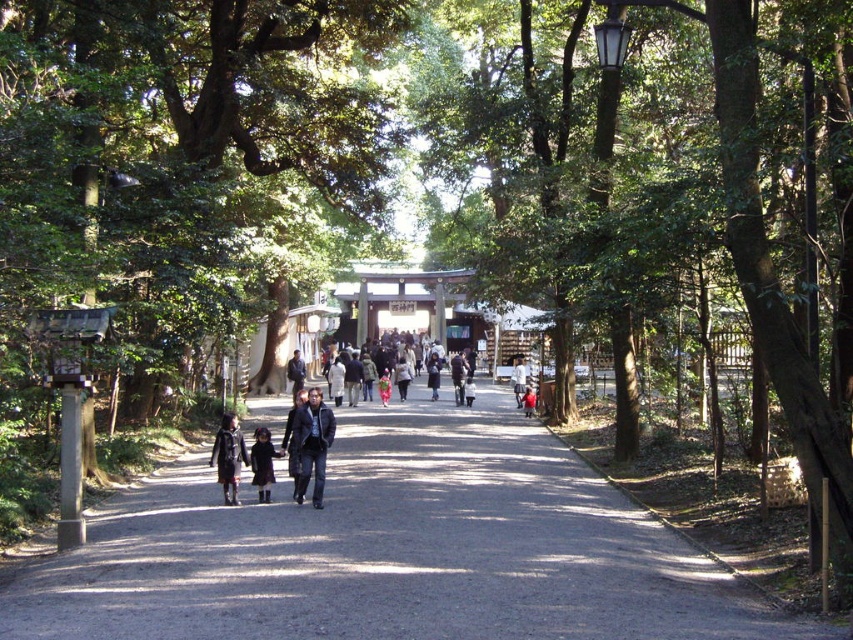
You are standing at the entrance of the pathway and see both the dark blue leather jacket at center and the light brown leather jacket at center. If you want to pick up both jackets, which one should you go to first to minimize the distance you walk?

You should go to the dark blue leather jacket at center first because it is closer to you than the light brown leather jacket at center, which is 21.97 meters away from it.

You are a hiker carrying a backpack and want to place both the dark blue leather jacket at center and the dark brown leather coat at center on the ground next to the path. Considering the narrowness of the path, can you safely place both items on the ground without blocking the pathway for other hikers?

The dark blue leather jacket at center is 1.09 meters away from the dark brown leather coat at center. Since the path is narrow, placing both items on the ground might block the pathway for other hikers. It is safer to find a wider spot or use your backpack to carry them temporarily.

You are a hiker who wants to walk along the dirt path at center. However, you notice a person wearing a dark blue jacket at center is standing on the path. Can you pass them without leaving the path?

The dirt path at center is shorter than the dark blue jacket at center, meaning the path is not wide enough to accommodate both you and the person simultaneously. You would need to wait for them to move or find an alternative route around them while staying on the path.